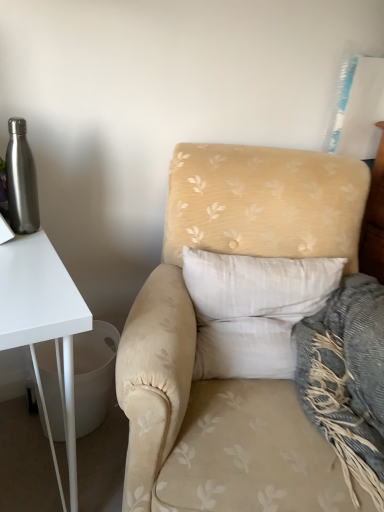
Question: Could you tell me if brushed metal water bottle at left is turned towards beige floral fabric armchair at center?

Choices:
 (A) yes
 (B) no

Answer: (B)

Question: From the image's perspective, is brushed metal water bottle at left under beige floral fabric armchair at center?

Choices:
 (A) no
 (B) yes

Answer: (A)

Question: Is brushed metal water bottle at left in contact with beige floral fabric armchair at center?

Choices:
 (A) yes
 (B) no

Answer: (B)

Question: Is brushed metal water bottle at left positioned beyond the bounds of beige floral fabric armchair at center?

Choices:
 (A) yes
 (B) no

Answer: (A)

Question: Is there a large distance between brushed metal water bottle at left and beige floral fabric armchair at center?

Choices:
 (A) yes
 (B) no

Answer: (B)

Question: From the image's perspective, is brushed metal water bottle at left over beige floral fabric armchair at center?

Choices:
 (A) yes
 (B) no

Answer: (A)

Question: From a real-world perspective, does brushed metal water bottle at left sit lower than white soft pillow at center?

Choices:
 (A) yes
 (B) no

Answer: (B)

Question: Is brushed metal water bottle at left oriented away from white soft pillow at center?

Choices:
 (A) no
 (B) yes

Answer: (A)

Question: Does brushed metal water bottle at left appear on the right side of white soft pillow at center?

Choices:
 (A) no
 (B) yes

Answer: (A)

Question: From a real-world perspective, is brushed metal water bottle at left on white soft pillow at center?

Choices:
 (A) no
 (B) yes

Answer: (B)

Question: Is brushed metal water bottle at left to the left of white soft pillow at center from the viewer's perspective?

Choices:
 (A) yes
 (B) no

Answer: (A)

Question: Is brushed metal water bottle at left smaller than white soft pillow at center?

Choices:
 (A) yes
 (B) no

Answer: (A)

Question: From the image's perspective, is beige floral fabric armchair at center under white soft pillow at center?

Choices:
 (A) yes
 (B) no

Answer: (A)